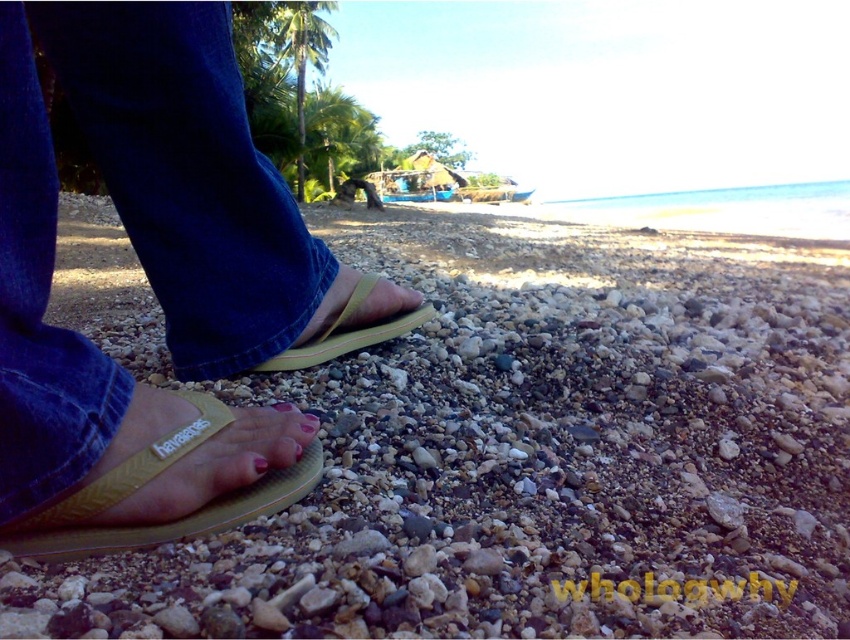
Question: Among these objects, which one is farthest from the camera?

Choices:
 (A) pink matte nail at center
 (B) yellow rubber sandal at center
 (C) yellow rubber flip-flops at center

Answer: (B)

Question: Does yellow rubber sandal at lower left have a greater width compared to yellow rubber sandal at center?

Choices:
 (A) no
 (B) yes

Answer: (A)

Question: Which point is farther from the camera taking this photo?

Choices:
 (A) (276, 49)
 (B) (414, 326)
 (C) (265, 465)

Answer: (A)

Question: Which object is positioned farthest from the green leafy palm tree at upper center?

Choices:
 (A) pink matte nail at center
 (B) yellow rubber flip-flops at center
 (C) yellow rubber sandal at center
 (D) yellow rubber flip-flops at lower left

Answer: (A)

Question: Is yellow rubber flip-flops at center bigger than green leafy palm tree at upper left?

Choices:
 (A) no
 (B) yes

Answer: (B)

Question: Is green leafy palm tree at upper left above matte yellow flip-flop at lower left?

Choices:
 (A) no
 (B) yes

Answer: (B)